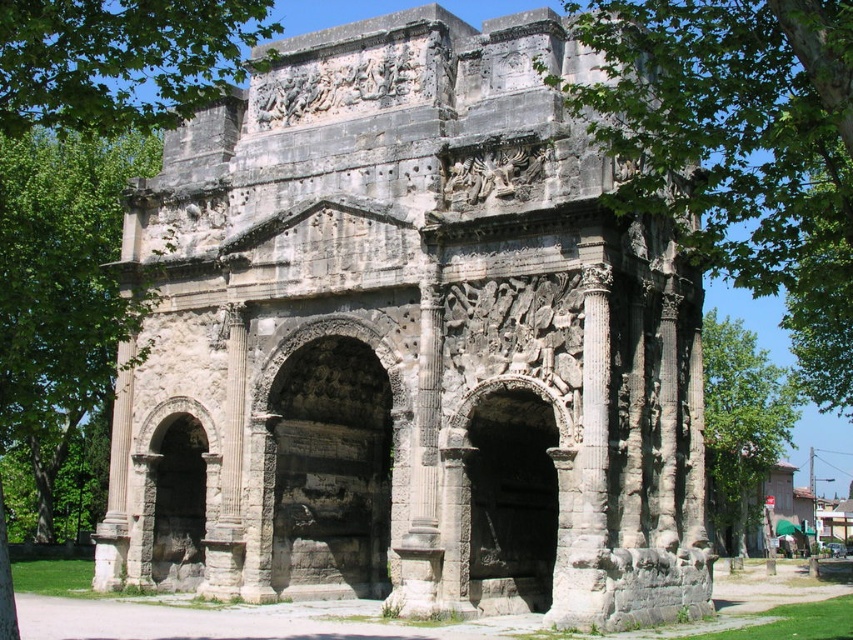
You are standing in front of the Triumphal Arch of Orange and notice the gray stone archway at center and the green leafy tree at center. Which object appears taller from your viewpoint?

The green leafy tree at center appears taller than the gray stone archway at center because the gray stone archway at center has a lesser height compared to the green leafy tree at center.

You are standing at the base of the Triumphal Arch of Orange and want to take a photo of the green leafy tree at upper right. If your camera has a maximum focus range of 100 feet, will you be able to capture the tree clearly?

The green leafy tree at upper right is 101.87 feet away from the camera, which exceeds the maximum focus range of 100 feet. Therefore, the camera will not be able to capture the tree clearly.

You are a tourist standing in front of the Triumphal Arch of Orange. You notice the gray stone archway at center and the green leafy tree at center. Which one appears to be larger in size?

The green leafy tree at center appears larger in size compared to the gray stone archway at center, as the gray stone archway at center has a smaller size compared to green leafy tree at center.